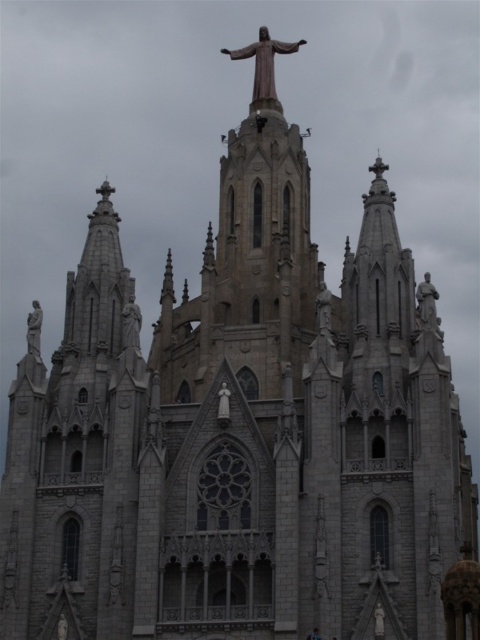
Question: In this image, where is gray stone statue at left located relative to polished stone statue at center?

Choices:
 (A) above
 (B) below

Answer: (B)

Question: Which of the following is the closest to the observer?

Choices:
 (A) gray stone statue at left
 (B) gray stone statue at center
 (C) white marble statue at right
 (D) bronze statue at upper center

Answer: (A)

Question: Estimate the real-world distances between objects in this image. Which object is closer to the white marble statue at right?

Choices:
 (A) gray stone statue at left
 (B) gray stone statue at center
 (C) white stone statue at center

Answer: (C)

Question: Among these points, which one is farthest from the camera?

Choices:
 (A) tap(143, 573)
 (B) tap(331, 296)
 (C) tap(40, 317)

Answer: (C)

Question: Is bronze statue at upper center closer to the viewer compared to white marble statue at right?

Choices:
 (A) no
 (B) yes

Answer: (A)

Question: Observing the image, what is the correct spatial positioning of white marble statue at right in reference to white stone statue at center?

Choices:
 (A) below
 (B) above

Answer: (B)